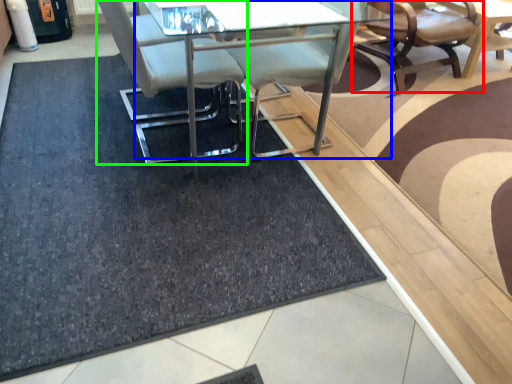
Question: Estimate the real-world distances between objects in this image. Which object is closer to chair (highlighted by a red box), table (highlighted by a blue box) or chair (highlighted by a green box)?

Choices:
 (A) table
 (B) chair

Answer: (A)